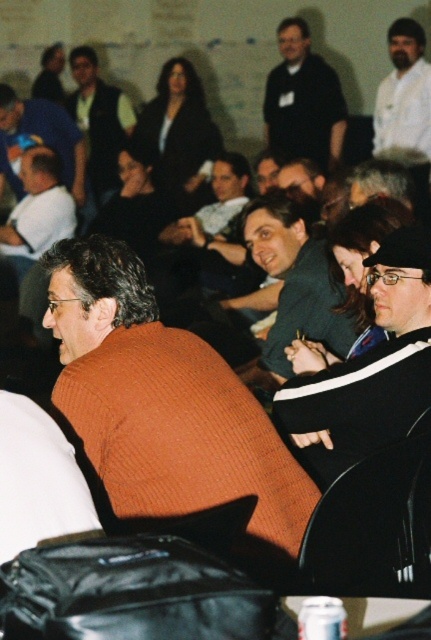
Question: Where is black knit sweater at center located in relation to dark blue shirt at upper center in the image?

Choices:
 (A) left
 (B) right

Answer: (A)

Question: Can you confirm if orange knitted sweater at center is positioned to the right of matte blue shirt at center?

Choices:
 (A) yes
 (B) no

Answer: (A)

Question: Which of the following is the closest to the observer?

Choices:
 (A) (293, 65)
 (B) (171, 164)
 (C) (355, 308)

Answer: (C)

Question: Based on their relative distances, which object is nearer to the matte blue shirt at center?

Choices:
 (A) white shirt at upper right
 (B) matte black jacket at upper center
 (C) black knit sweater at center

Answer: (B)

Question: Which of the following is the farthest from the observer?

Choices:
 (A) (71, 132)
 (B) (65, 189)
 (C) (255, 436)

Answer: (A)

Question: Can you confirm if white shirt at center is wider than matte blue shirt at center?

Choices:
 (A) no
 (B) yes

Answer: (A)